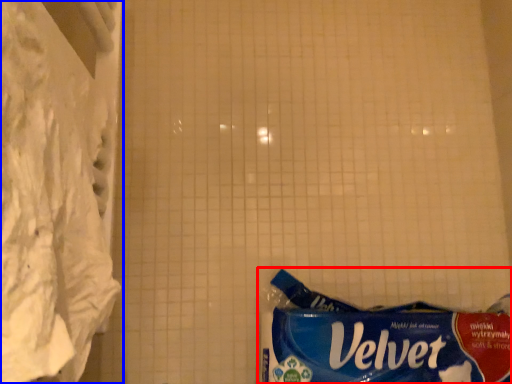
Question: Which of the following is the farthest to the observer, waste (highlighted by a red box) or curtain (highlighted by a blue box)?

Choices:
 (A) waste
 (B) curtain

Answer: (A)